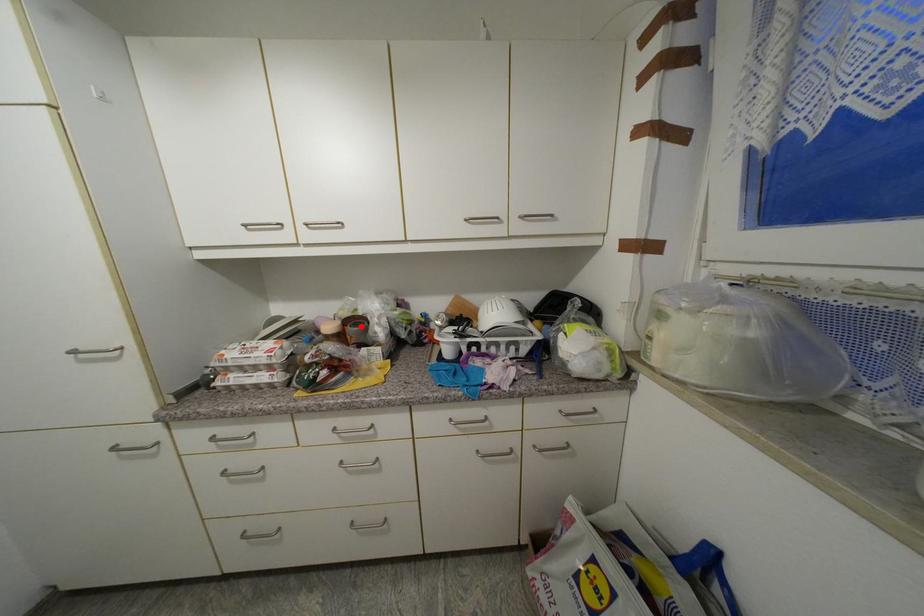
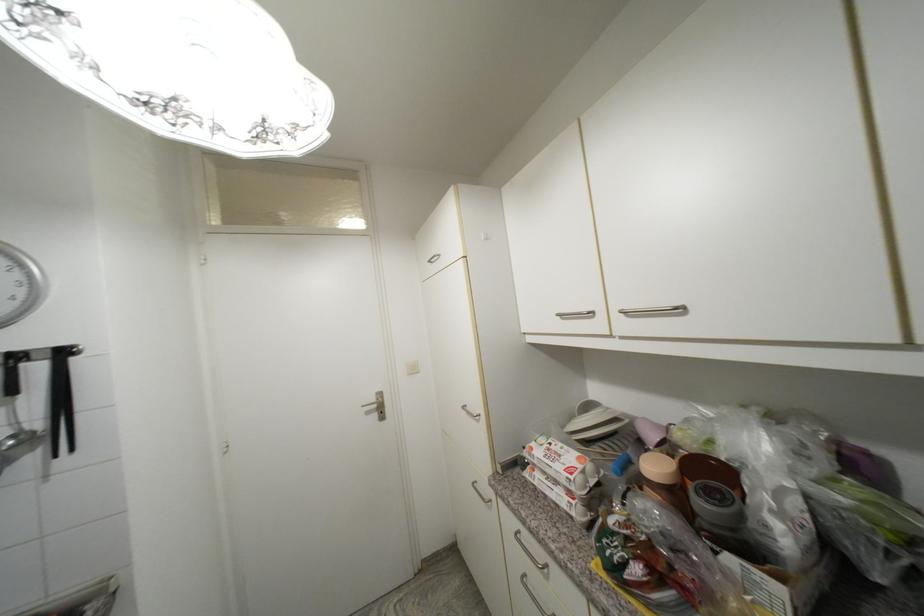
The point at the highlighted location is marked in the first image. Where is the corresponding point in the second image?

(714, 496)